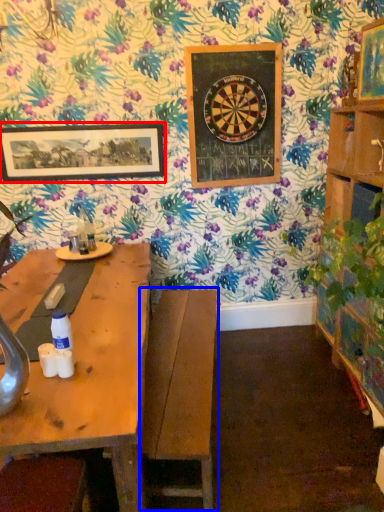
Question: Among these objects, which one is farthest to the camera, picture frame (highlighted by a red box) or swivel chair (highlighted by a blue box)?

Choices:
 (A) picture frame
 (B) swivel chair

Answer: (A)